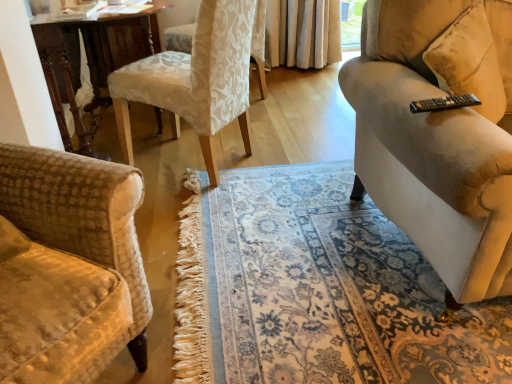
Question: Considering their positions, is white fabric chair at center, the 1th chair from the front, located in front of or behind white damask fabric chair at upper center, the 2th chair from the front?

Choices:
 (A) behind
 (B) front

Answer: (B)

Question: Based on their sizes in the image, would you say white fabric chair at center, the 1th chair from the front, is bigger or smaller than white damask fabric chair at upper center, the 2th chair from the front?

Choices:
 (A) small
 (B) big

Answer: (B)

Question: Estimate the real-world distances between objects in this image. Which object is closer to the wooden table at center?

Choices:
 (A) white fabric chair at center, which is the 2th chair from back to front
 (B) white damask fabric chair at upper center, the 2th chair from the front

Answer: (A)

Question: Based on their relative distances, which object is nearer to the wooden table at center?

Choices:
 (A) white damask fabric chair at upper center, arranged as the first chair when viewed from the back
 (B) white fabric chair at center, the 1th chair from the front

Answer: (B)